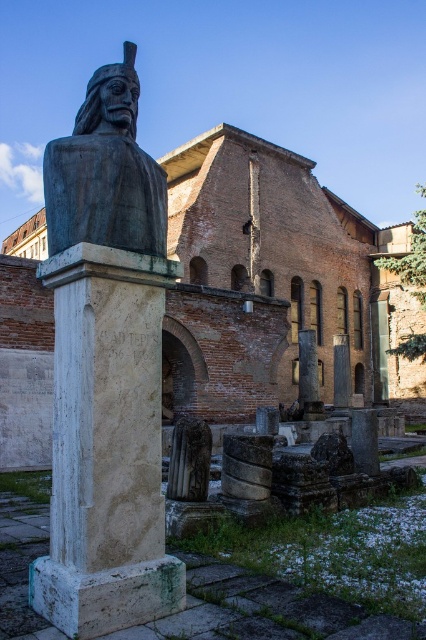
Does bronze statue at center appear on the left side of smooth gray stone pillar at center?

Yes, bronze statue at center is to the left of smooth gray stone pillar at center.

Between point (144, 202) and point (377, 472), which one is positioned in front?

Point (144, 202)

Between point (155, 252) and point (371, 435), which one is positioned in front?

Point (155, 252)

Where is `bronze statue at center`? This screenshot has width=426, height=640. bronze statue at center is located at coordinates (106, 172).

Can you confirm if carved stone statue at center is taller than smooth stone pillar at center?

Incorrect, carved stone statue at center's height is not larger of smooth stone pillar at center's.

Does point (184, 429) lie in front of point (337, 340)?

Yes, it is.

Identify the location of carved stone statue at center. (189, 460).

Between white marble column at center and bronze statue at center, which one has less height?

Standing shorter between the two is white marble column at center.

Which is in front, point (89, 244) or point (57, 161)?

Point (89, 244)

I want to click on white marble column at center, so click(106, 445).